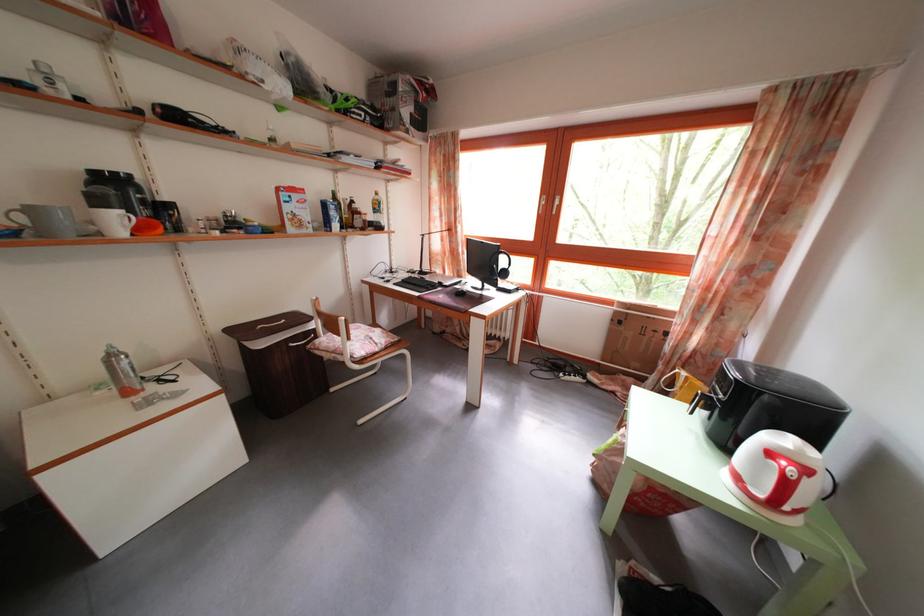
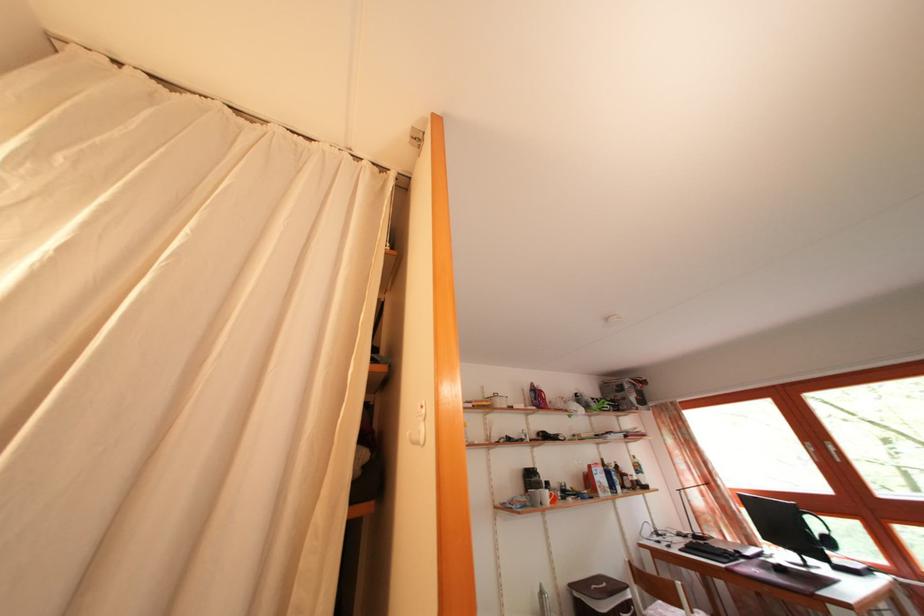
In the second image, find the point that corresponds to point 513,281 in the first image.

(837, 549)